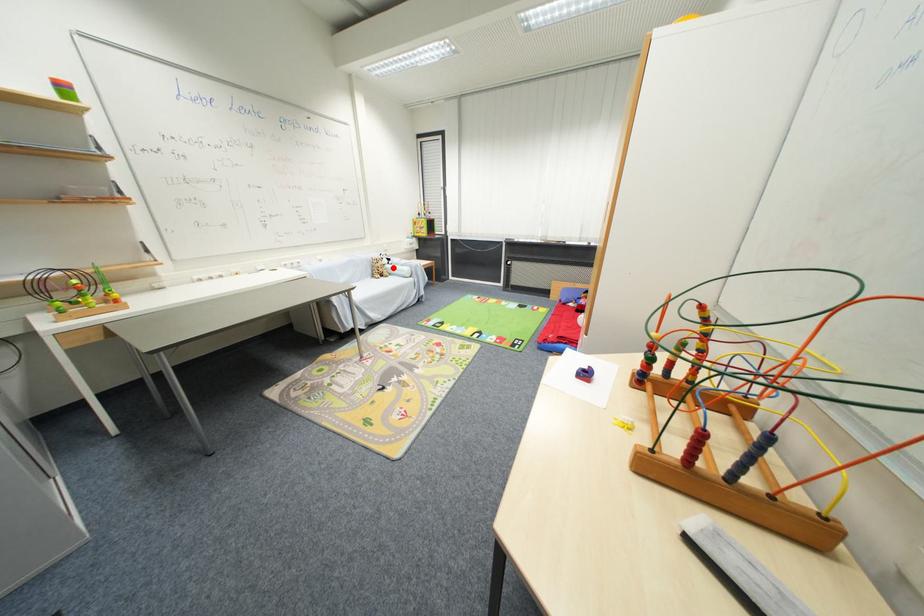
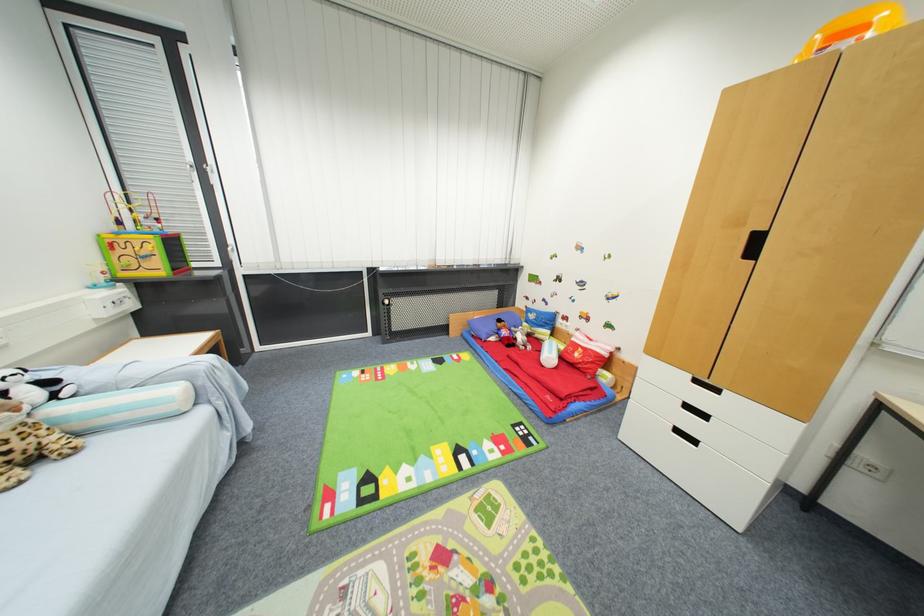
Question: I am providing you with two images of the same scene from different viewpoints. Given a red point in image1, look at the same physical point in image2. Is it:

Choices:
 (A) Closer to the viewpoint
 (B) Farther from the viewpoint

Answer: (B)